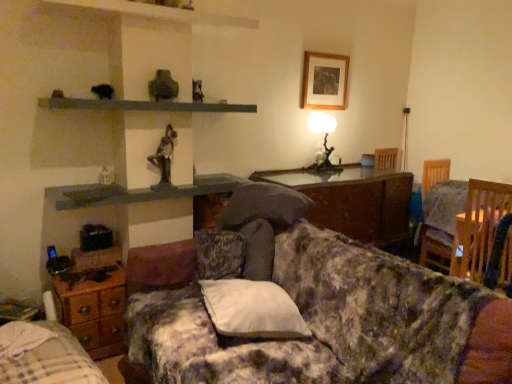
Question: Can you confirm if floral fabric couch at center is positioned to the right of wooden chair at right?

Choices:
 (A) yes
 (B) no

Answer: (B)

Question: Is floral fabric couch at center not close to wooden chair at right?

Choices:
 (A) yes
 (B) no

Answer: (A)

Question: Does floral fabric couch at center have a greater height compared to wooden chair at right?

Choices:
 (A) no
 (B) yes

Answer: (B)

Question: Is floral fabric couch at center next to wooden chair at right and touching it?

Choices:
 (A) no
 (B) yes

Answer: (A)

Question: Does floral fabric couch at center come in front of wooden chair at right?

Choices:
 (A) no
 (B) yes

Answer: (B)

Question: Is smooth gray shelf at upper center inside the boundaries of white soft pillow at center, or outside?

Choices:
 (A) inside
 (B) outside

Answer: (B)

Question: Based on their positions, is smooth gray shelf at upper center located to the left or right of white soft pillow at center?

Choices:
 (A) left
 (B) right

Answer: (A)

Question: Looking at the image, does smooth gray shelf at upper center seem bigger or smaller compared to white soft pillow at center?

Choices:
 (A) small
 (B) big

Answer: (B)

Question: In the image, is smooth gray shelf at upper center positioned in front of or behind white soft pillow at center?

Choices:
 (A) front
 (B) behind

Answer: (B)

Question: From the image's perspective, is floral fabric couch at center located above or below white soft pillow at center?

Choices:
 (A) below
 (B) above

Answer: (A)

Question: Is point (317, 274) positioned closer to the camera than point (249, 326)?

Choices:
 (A) closer
 (B) farther

Answer: (B)

Question: In terms of width, does floral fabric couch at center look wider or thinner when compared to white soft pillow at center?

Choices:
 (A) wide
 (B) thin

Answer: (A)

Question: Considering the positions of floral fabric couch at center and white soft pillow at center in the image, is floral fabric couch at center taller or shorter than white soft pillow at center?

Choices:
 (A) tall
 (B) short

Answer: (A)

Question: Is wooden bed frame at lower left wider or thinner than wooden picture frame at upper center?

Choices:
 (A) wide
 (B) thin

Answer: (A)

Question: Considering the positions of wooden bed frame at lower left and wooden picture frame at upper center in the image, is wooden bed frame at lower left taller or shorter than wooden picture frame at upper center?

Choices:
 (A) short
 (B) tall

Answer: (B)